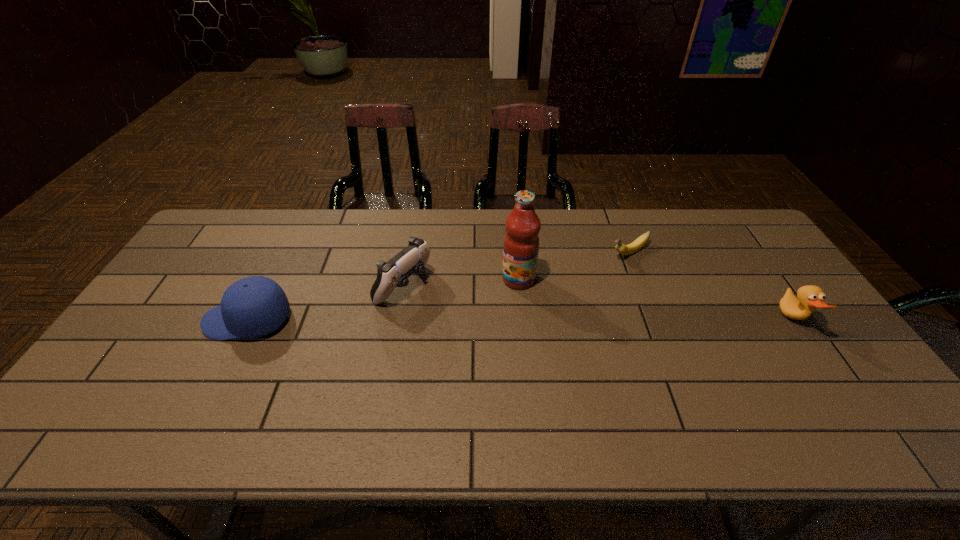
The height and width of the screenshot is (540, 960). In order to click on free point between the tallest object and the control in this screenshot , I will do coord(461,282).

This screenshot has width=960, height=540. I want to click on vacant space in between the banana and the leftmost object, so click(438, 287).

The width and height of the screenshot is (960, 540). In order to click on free space between the leftmost object and the control in this screenshot , I will do `click(325, 303)`.

Locate an element on the screen. The width and height of the screenshot is (960, 540). vacant space that's between the control and the tallest object is located at coordinates (461, 282).

Identify the location of vacant point located between the shortest object and the duck. Image resolution: width=960 pixels, height=540 pixels. (710, 286).

Identify which object is the fourth nearest to the fourth object from right to left. Please provide its 2D coordinates. Your answer should be formatted as a tuple, i.e. [(x, y)], where the tuple contains the x and y coordinates of a point satisfying the conditions above.

[(810, 297)]

Identify which object is the fourth closest to the cap. Please provide its 2D coordinates. Your answer should be formatted as a tuple, i.e. [(x, y)], where the tuple contains the x and y coordinates of a point satisfying the conditions above.

[(810, 297)]

The width and height of the screenshot is (960, 540). In order to click on free point that satisfies the following two spatial constraints: 1. on the front side of the second object from left to right; 2. on the beak of the duck in this screenshot , I will do `click(397, 320)`.

You are a GUI agent. You are given a task and a screenshot of the screen. Output one action in this format:
    pyautogui.click(x=<x>, y=<y>)
    Task: Click on the free space that satisfies the following two spatial constraints: 1. on the front side of the fourth object from right to left; 2. on the beak of the rightmost object
    This screenshot has width=960, height=540.
    Given the screenshot: What is the action you would take?
    coord(397,320)